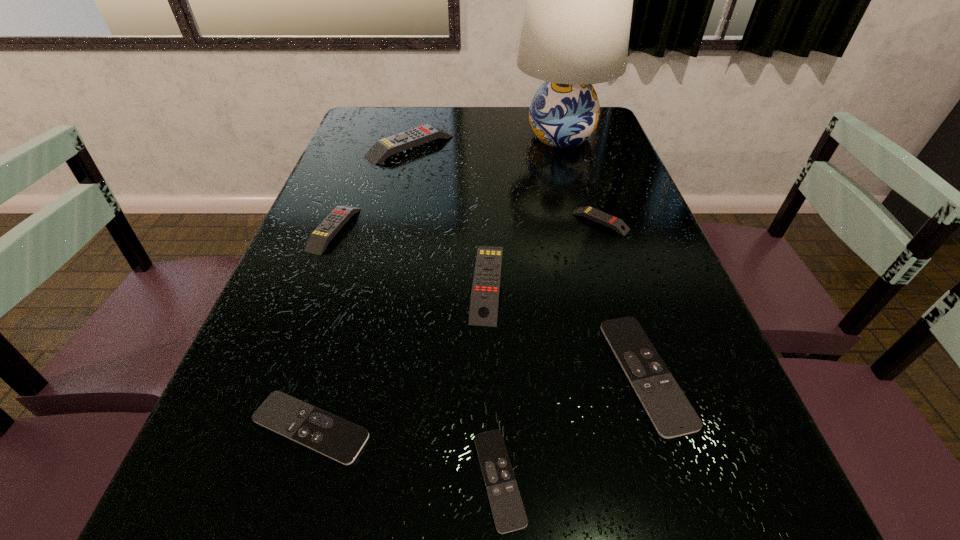
Find the location of a particular element. The width and height of the screenshot is (960, 540). blue lampshade is located at coordinates (576, 27).

This screenshot has width=960, height=540. In order to click on the tallest object in this screenshot , I will do `click(576, 27)`.

Image resolution: width=960 pixels, height=540 pixels. I want to click on the biggest yellow remote control, so click(382, 149).

This screenshot has height=540, width=960. I want to click on the farthest remote control, so click(x=382, y=149).

I want to click on the third smallest yellow remote control, so click(x=484, y=301).

The width and height of the screenshot is (960, 540). What are the coordinates of `the second yellow remote control from right to left` in the screenshot? It's located at (484, 301).

Identify the location of the third tallest remote control. (318, 240).

Locate an element on the screen. This screenshot has height=540, width=960. the fourth tallest object is located at coordinates (318, 240).

Identify the location of the fourth shortest object. The image size is (960, 540). (598, 216).

Where is `the smallest yellow remote control`? the smallest yellow remote control is located at coordinates (598, 216).